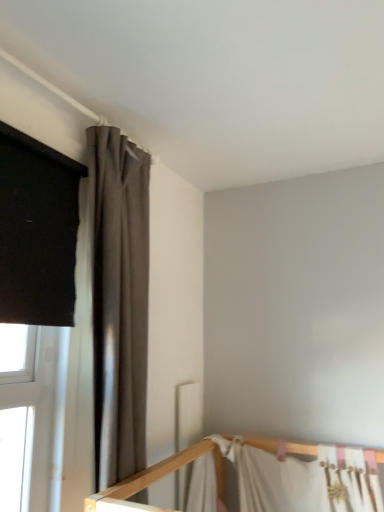
Question: From a real-world perspective, is white fabric bed at lower right physically located above or below dark gray matte curtain at upper left?

Choices:
 (A) above
 (B) below

Answer: (B)

Question: Considering the positions of point (316, 451) and point (122, 464), is point (316, 451) closer or farther from the camera than point (122, 464)?

Choices:
 (A) closer
 (B) farther

Answer: (B)

Question: Looking at their shapes, would you say white fabric bed at lower right is wider or thinner than dark gray matte curtain at upper left?

Choices:
 (A) thin
 (B) wide

Answer: (A)

Question: Based on their sizes in the image, would you say dark gray matte curtain at upper left is bigger or smaller than white fabric bed at lower right?

Choices:
 (A) big
 (B) small

Answer: (A)

Question: Looking at their shapes, would you say dark gray matte curtain at upper left is wider or thinner than white fabric bed at lower right?

Choices:
 (A) wide
 (B) thin

Answer: (A)

Question: In the image, is dark gray matte curtain at upper left positioned in front of or behind white fabric bed at lower right?

Choices:
 (A) behind
 (B) front

Answer: (B)

Question: Is point (139, 328) closer or farther from the camera than point (372, 485)?

Choices:
 (A) farther
 (B) closer

Answer: (B)